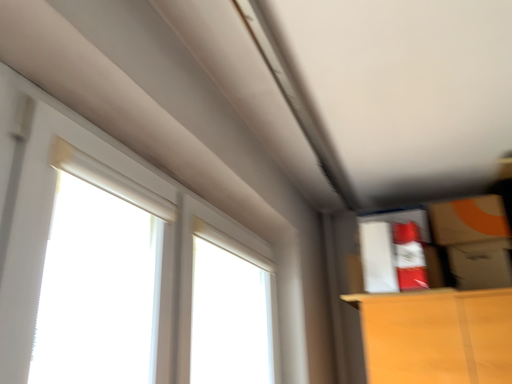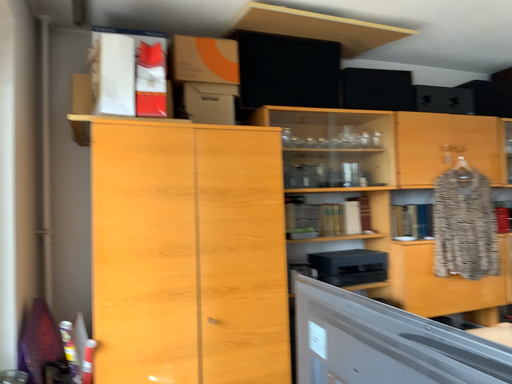
Question: Which way did the camera rotate in the video?

Choices:
 (A) rotated upward
 (B) rotated downward

Answer: (B)